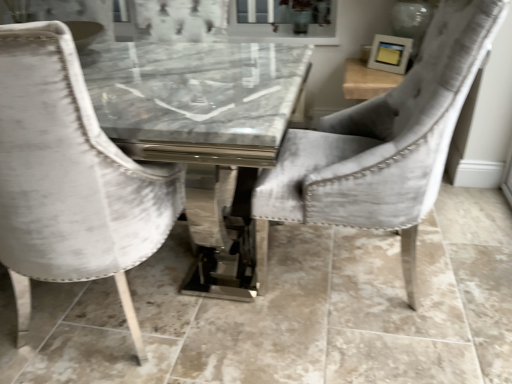
What do you see at coordinates (70, 178) in the screenshot? This screenshot has width=512, height=384. I see `velvet white chair at left, the second chair positioned from the right` at bounding box center [70, 178].

Image resolution: width=512 pixels, height=384 pixels. Identify the location of velvet white chair at left, which is the first chair in left-to-right order. (70, 178).

What is the approximate height of velvet white chair at left, which is the first chair in left-to-right order?

It is 3.38 feet.

Where is `velvet gray chair at center, the 2th chair positioned from the left`? The image size is (512, 384). velvet gray chair at center, the 2th chair positioned from the left is located at coordinates (382, 144).

Describe the element at coordinates (382, 144) in the screenshot. The height and width of the screenshot is (384, 512). I see `velvet gray chair at center, which is counted as the 1th chair, starting from the right` at that location.

Find the location of `velvet white chair at left, the second chair positioned from the right`. velvet white chair at left, the second chair positioned from the right is located at coordinates (70, 178).

Which object is positioned more to the right, velvet white chair at left, which is the first chair in left-to-right order, or velvet gray chair at center, the 2th chair positioned from the left?

velvet gray chair at center, the 2th chair positioned from the left.

Is velvet white chair at left, the second chair positioned from the right, positioned in front of velvet gray chair at center, the 2th chair positioned from the left?

Yes, it is in front of velvet gray chair at center, the 2th chair positioned from the left.

Considering the positions of points (152, 245) and (339, 205), is point (152, 245) closer to camera compared to point (339, 205)?

Yes, it is.

From the image's perspective, is velvet white chair at left, which is the first chair in left-to-right order, located beneath velvet gray chair at center, the 2th chair positioned from the left?

Yes.

From a real-world perspective, is velvet white chair at left, which is the first chair in left-to-right order, on top of velvet gray chair at center, which is counted as the 1th chair, starting from the right?

Actually, velvet white chair at left, which is the first chair in left-to-right order, is physically below velvet gray chair at center, which is counted as the 1th chair, starting from the right, in the real world.

Considering the relative sizes of velvet white chair at left, the second chair positioned from the right, and velvet gray chair at center, which is counted as the 1th chair, starting from the right, in the image provided, is velvet white chair at left, the second chair positioned from the right, thinner than velvet gray chair at center, which is counted as the 1th chair, starting from the right,?

Yes.

Does velvet white chair at left, which is the first chair in left-to-right order, have a greater height compared to velvet gray chair at center, which is counted as the 1th chair, starting from the right?

Yes, velvet white chair at left, which is the first chair in left-to-right order, is taller than velvet gray chair at center, which is counted as the 1th chair, starting from the right.

Considering the sizes of objects velvet white chair at left, the second chair positioned from the right, and velvet gray chair at center, the 2th chair positioned from the left, in the image provided, who is bigger, velvet white chair at left, the second chair positioned from the right, or velvet gray chair at center, the 2th chair positioned from the left,?

With larger size is velvet gray chair at center, the 2th chair positioned from the left.

Would you say velvet white chair at left, which is the first chair in left-to-right order, is inside or outside velvet gray chair at center, which is counted as the 1th chair, starting from the right?

velvet white chair at left, which is the first chair in left-to-right order, is not enclosed by velvet gray chair at center, which is counted as the 1th chair, starting from the right.

Are velvet white chair at left, which is the first chair in left-to-right order, and velvet gray chair at center, which is counted as the 1th chair, starting from the right, located far from each other?

Actually, velvet white chair at left, which is the first chair in left-to-right order, and velvet gray chair at center, which is counted as the 1th chair, starting from the right, are a little close together.

Is velvet white chair at left, which is the first chair in left-to-right order, aimed at velvet gray chair at center, which is counted as the 1th chair, starting from the right?

No, velvet white chair at left, which is the first chair in left-to-right order, is not turned towards velvet gray chair at center, which is counted as the 1th chair, starting from the right.

How different are the orientations of velvet white chair at left, the second chair positioned from the right, and velvet gray chair at center, which is counted as the 1th chair, starting from the right, in degrees?

The angular difference between velvet white chair at left, the second chair positioned from the right, and velvet gray chair at center, which is counted as the 1th chair, starting from the right, is 90 degrees.

Consider the image. How far apart are velvet white chair at left, the second chair positioned from the right, and velvet gray chair at center, the 2th chair positioned from the left?

velvet white chair at left, the second chair positioned from the right, and velvet gray chair at center, the 2th chair positioned from the left, are 24.31 inches apart.

You are a GUI agent. You are given a task and a screenshot of the screen. Output one action in this format:
    pyautogui.click(x=<x>, y=<y>)
    Task: Click on the chair lying in front of the velvet gray chair at center, the 2th chair positioned from the left
    The height and width of the screenshot is (384, 512).
    Given the screenshot: What is the action you would take?
    (70, 178)

Which is more to the left, velvet gray chair at center, the 2th chair positioned from the left, or velvet white chair at left, which is the first chair in left-to-right order?

velvet white chair at left, which is the first chair in left-to-right order.

In the scene shown: Between velvet gray chair at center, which is counted as the 1th chair, starting from the right, and velvet white chair at left, which is the first chair in left-to-right order, which one is positioned in front?

velvet white chair at left, which is the first chair in left-to-right order, is in front.

Is point (334, 176) closer or farther from the camera than point (74, 233)?

Point (334, 176).

From the image's perspective, which is above, velvet gray chair at center, which is counted as the 1th chair, starting from the right, or velvet white chair at left, which is the first chair in left-to-right order?

velvet gray chair at center, which is counted as the 1th chair, starting from the right, is shown above in the image.

From a real-world perspective, which is physically below, velvet gray chair at center, which is counted as the 1th chair, starting from the right, or velvet white chair at left, the second chair positioned from the right?

velvet white chair at left, the second chair positioned from the right.

Is velvet gray chair at center, the 2th chair positioned from the left, wider than velvet white chair at left, which is the first chair in left-to-right order?

Indeed, velvet gray chair at center, the 2th chair positioned from the left, has a greater width compared to velvet white chair at left, which is the first chair in left-to-right order.

Is velvet gray chair at center, which is counted as the 1th chair, starting from the right, taller than velvet white chair at left, the second chair positioned from the right?

In fact, velvet gray chair at center, which is counted as the 1th chair, starting from the right, may be shorter than velvet white chair at left, the second chair positioned from the right.

Considering the relative sizes of velvet gray chair at center, which is counted as the 1th chair, starting from the right, and velvet white chair at left, which is the first chair in left-to-right order, in the image provided, is velvet gray chair at center, which is counted as the 1th chair, starting from the right, bigger than velvet white chair at left, which is the first chair in left-to-right order,?

Yes, velvet gray chair at center, which is counted as the 1th chair, starting from the right, is bigger than velvet white chair at left, which is the first chair in left-to-right order.

Is velvet gray chair at center, which is counted as the 1th chair, starting from the right, not inside velvet white chair at left, the second chair positioned from the right?

Yes, velvet gray chair at center, which is counted as the 1th chair, starting from the right, is outside of velvet white chair at left, the second chair positioned from the right.

Are velvet gray chair at center, the 2th chair positioned from the left, and velvet white chair at left, the second chair positioned from the right, located far from each other?

That's not correct — velvet gray chair at center, the 2th chair positioned from the left, is a little close to velvet white chair at left, the second chair positioned from the right.

Does velvet gray chair at center, the 2th chair positioned from the left, turn towards velvet white chair at left, which is the first chair in left-to-right order?

Yes, velvet gray chair at center, the 2th chair positioned from the left, is turned towards velvet white chair at left, which is the first chair in left-to-right order.

How many degrees apart are the facing directions of velvet gray chair at center, the 2th chair positioned from the left, and velvet white chair at left, the second chair positioned from the right?

90 degrees.

This screenshot has width=512, height=384. In order to click on chair on the left of velvet gray chair at center, the 2th chair positioned from the left in this screenshot , I will do `click(70, 178)`.

At what (x,y) coordinates should I click in order to perform the action: click on chair located behind the velvet white chair at left, the second chair positioned from the right. Please return your answer as a coordinate pair (x, y). Looking at the image, I should click on (382, 144).

In order to click on chair on the right of velvet white chair at left, which is the first chair in left-to-right order in this screenshot , I will do `click(382, 144)`.